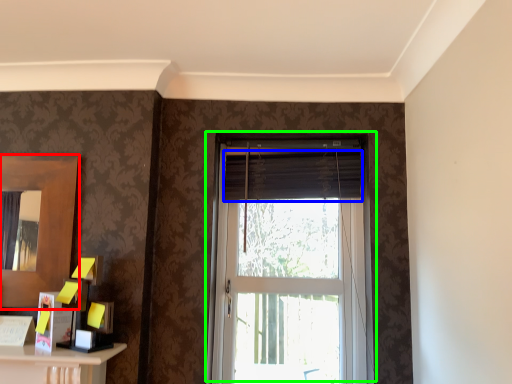
Question: Which object is positioned closest to mirror (highlighted by a red box)? Select from curtain (highlighted by a blue box) and window (highlighted by a green box).

Choices:
 (A) curtain
 (B) window

Answer: (A)